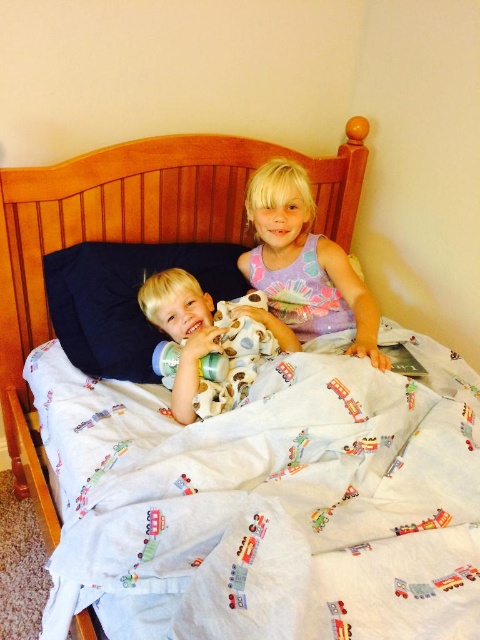
From the picture: Who is more distant from viewer, (106, 312) or (254, 339)?

Point (106, 312)

Is dark blue fabric pillow at left closer to the viewer compared to matte white plush toy at center?

No, dark blue fabric pillow at left is further to the viewer.

Is point (73, 256) behind point (168, 296)?

Yes.

Locate an element on the screen. The image size is (480, 640). dark blue fabric pillow at left is located at coordinates (124, 298).

Who is shorter, pastel tie-dye tank top at upper center or matte white plush toy at center?

With less height is matte white plush toy at center.

Can you confirm if pastel tie-dye tank top at upper center is positioned above matte white plush toy at center?

Indeed, pastel tie-dye tank top at upper center is positioned over matte white plush toy at center.

Is point (283, 275) closer to camera compared to point (175, 292)?

No, it is not.

Where is `pastel tie-dye tank top at upper center`? The width and height of the screenshot is (480, 640). pastel tie-dye tank top at upper center is located at coordinates (304, 262).

Between dark blue fabric pillow at left and pastel tie-dye tank top at upper center, which one has less height?

Standing shorter between the two is dark blue fabric pillow at left.

Who is more distant from viewer, (95, 288) or (324, 241)?

The point (324, 241) is behind.

Who is more distant from viewer, (84,349) or (302,234)?

Positioned behind is point (302,234).

I want to click on dark blue fabric pillow at left, so click(124, 298).